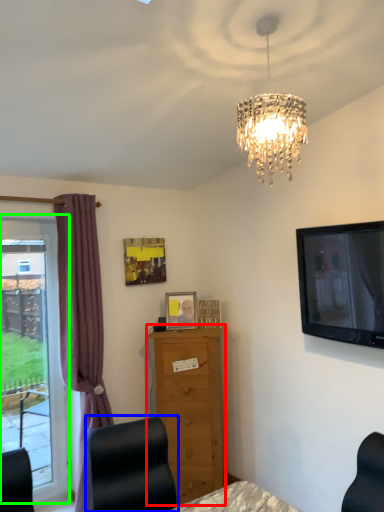
Question: Which object is positioned closest to chest of drawers (highlighted by a red box)? Select from furniture (highlighted by a blue box) and window (highlighted by a green box).

Choices:
 (A) furniture
 (B) window

Answer: (B)